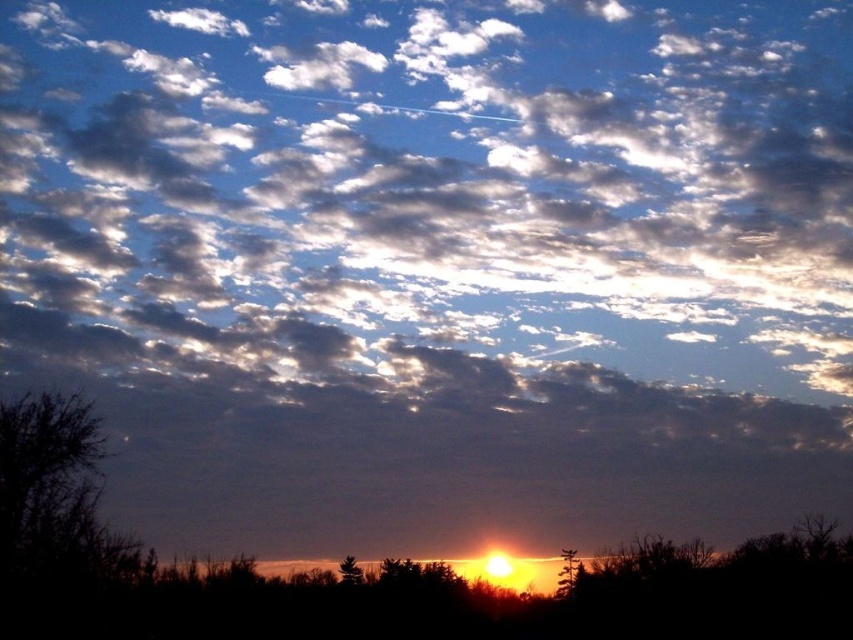
Between point (561, 548) and point (346, 579), which one is positioned in front?

Positioned in front is point (346, 579).

Does brown textured tree at lower center have a greater width compared to silvery textured pine tree at center?

Yes, brown textured tree at lower center is wider than silvery textured pine tree at center.

Is point (579, 563) farther from camera compared to point (357, 576)?

That is True.

The width and height of the screenshot is (853, 640). Identify the location of brown textured tree at lower center. [567, 572].